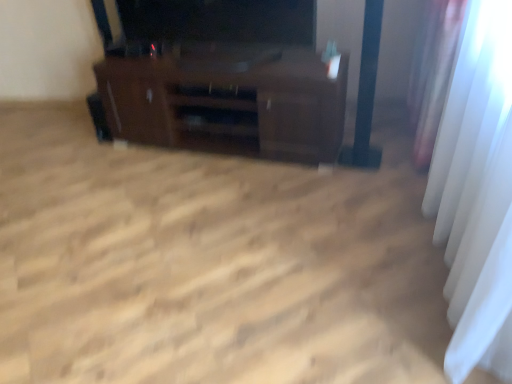
Question: From a real-world perspective, is dark brown wood tv stand at center over white sheer curtain at right?

Choices:
 (A) yes
 (B) no

Answer: (B)

Question: Is dark brown wood tv stand at center directly adjacent to white sheer curtain at right?

Choices:
 (A) yes
 (B) no

Answer: (B)

Question: Does dark brown wood tv stand at center appear on the right side of white sheer curtain at right?

Choices:
 (A) yes
 (B) no

Answer: (B)

Question: Is dark brown wood tv stand at center wider than white sheer curtain at right?

Choices:
 (A) yes
 (B) no

Answer: (A)

Question: From a real-world perspective, is dark brown wood tv stand at center physically below white sheer curtain at right?

Choices:
 (A) yes
 (B) no

Answer: (A)

Question: Does dark brown wood tv stand at center have a larger size compared to white sheer curtain at right?

Choices:
 (A) yes
 (B) no

Answer: (B)

Question: Is white sheer curtain at right wider than dark brown wood tv stand at center?

Choices:
 (A) no
 (B) yes

Answer: (A)

Question: Is white sheer curtain at right far away from dark brown wood tv stand at center?

Choices:
 (A) yes
 (B) no

Answer: (A)

Question: Is white sheer curtain at right thinner than dark brown wood tv stand at center?

Choices:
 (A) no
 (B) yes

Answer: (B)

Question: From a real-world perspective, is white sheer curtain at right under dark brown wood tv stand at center?

Choices:
 (A) no
 (B) yes

Answer: (A)

Question: Is white sheer curtain at right next to dark brown wood tv stand at center?

Choices:
 (A) yes
 (B) no

Answer: (B)

Question: Is white sheer curtain at right outside of dark brown wood tv stand at center?

Choices:
 (A) yes
 (B) no

Answer: (A)

Question: From their relative heights in the image, would you say dark brown wood tv stand at center is taller or shorter than white sheer curtain at right?

Choices:
 (A) short
 (B) tall

Answer: (A)